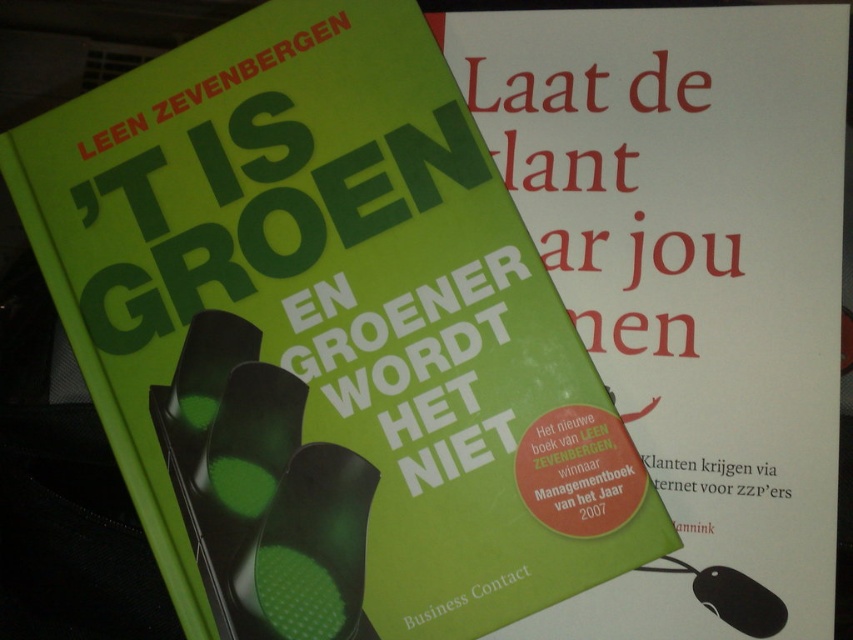
Question: Considering the relative positions of green matte book cover at upper right and black rubber mouse at lower right in the image provided, where is green matte book cover at upper right located with respect to black rubber mouse at lower right?

Choices:
 (A) below
 (B) above

Answer: (B)

Question: Which of the following is the farthest from the observer?

Choices:
 (A) black rubber mouse at lower right
 (B) green matte book cover at upper right

Answer: (A)

Question: Where is green matte book cover at upper right located in relation to black rubber mouse at lower right in the image?

Choices:
 (A) left
 (B) right

Answer: (A)

Question: Does green matte book cover at upper right appear on the right side of black rubber mouse at lower right?

Choices:
 (A) yes
 (B) no

Answer: (B)